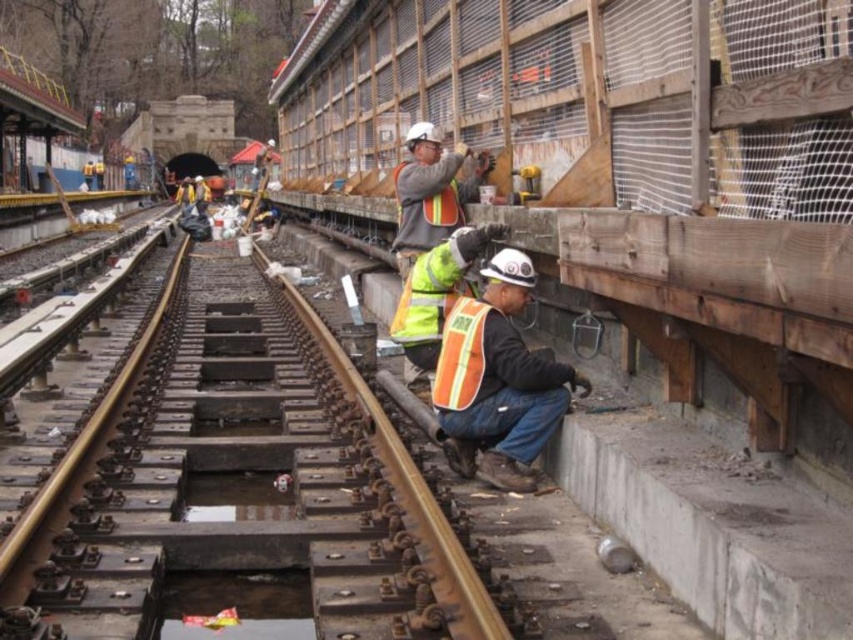
Question: Where is rusty metal track at center located in relation to orange reflective safety vest at center in the image?

Choices:
 (A) below
 (B) above

Answer: (A)

Question: Which of the following is the farthest from the observer?

Choices:
 (A) (422, 202)
 (B) (486, 316)
 (C) (514, 460)
 (D) (252, 508)

Answer: (A)

Question: Which is nearer to the rusty metal track at center?

Choices:
 (A) orange reflective vest at lower center
 (B) reflective orange safety vest at lower center
 (C) orange reflective safety vest at center

Answer: (A)

Question: Does reflective orange safety vest at lower center appear under orange reflective safety vest at center?

Choices:
 (A) yes
 (B) no

Answer: (A)

Question: Can you confirm if orange reflective vest at lower center is wider than orange reflective safety vest at center?

Choices:
 (A) yes
 (B) no

Answer: (A)

Question: Estimate the real-world distances between objects in this image. Which object is farther from the reflective orange safety vest at lower center?

Choices:
 (A) orange reflective safety vest at center
 (B) rusty metal track at center
 (C) orange reflective vest at lower center

Answer: (A)